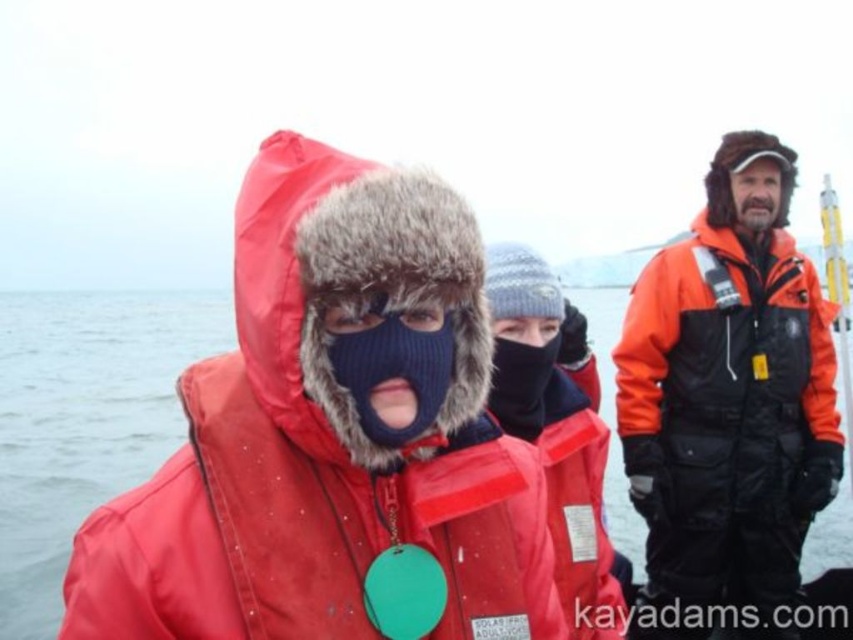
You are a photographer trying to capture a group photo of the knitted dark blue mask at center and the knitted woolen hat at center. Which object should you focus on first if you want to capture them both in the frame without moving the camera?

You should focus on the knitted dark blue mask at center first because it is positioned to the left of the knitted woolen hat at center, so it will be closer to the left edge of the frame. By centering your focus on the knitted dark blue mask at center, you can ensure both objects remain within the camera frame without needing to adjust the camera position.

You are a photographer trying to capture a closeup of the green plastic medal at center and the knitted woolen hat at center. Since both are at the same central position, which object should you focus on to ensure the medal is clearly visible in the photo?

The green plastic medal at center is larger in size than the knitted woolen hat at center, so focusing on the medal will ensure it is clearly visible in the photo.

You are a photographer trying to capture a clear shot of both the green plastic medal at center and the black knit mask at center. Which object should you focus on first to ensure both are in focus?

The green plastic medal at center is closer to the viewer than the black knit mask at center. To ensure both are in focus, you should focus on the green plastic medal at center first, as it is closer, and the depth of field will extend to the black knit mask at center.